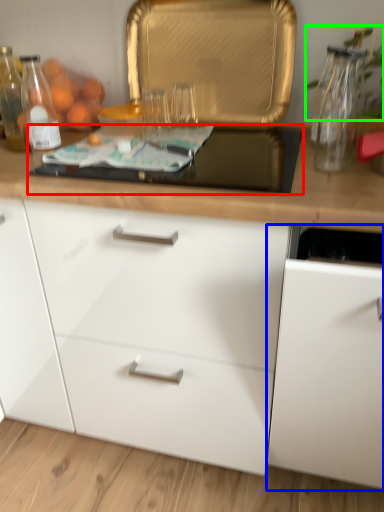
Question: Estimate the real-world distances between objects in this image. Which object is farther from gas stove (highlighted by a red box), cabinetry (highlighted by a blue box) or plant (highlighted by a green box)?

Choices:
 (A) cabinetry
 (B) plant

Answer: (A)